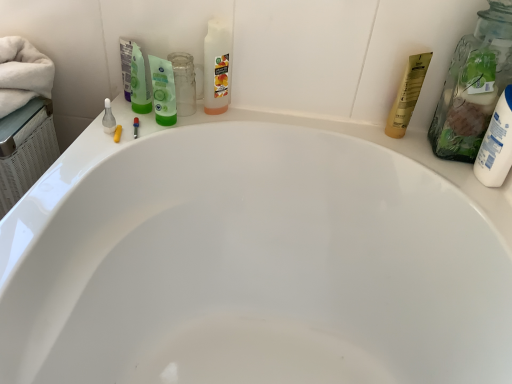
The height and width of the screenshot is (384, 512). What do you see at coordinates (407, 95) in the screenshot?
I see `yellow matte tube at upper right, the 2th toiletry viewed from the front` at bounding box center [407, 95].

Find the location of a particular element. The width and height of the screenshot is (512, 384). yellow matte tube at upper right, the second toiletry from the right is located at coordinates (407, 95).

Is translucent glass jar at upper right completely or partially inside yellow matte tube at upper right, the second toiletry from the right?

No, translucent glass jar at upper right is not a part of yellow matte tube at upper right, the second toiletry from the right.

What's the angular difference between yellow matte tube at upper right, the second toiletry from the right, and translucent glass jar at upper right's facing directions?

91.2 degrees separate the facing orientations of yellow matte tube at upper right, the second toiletry from the right, and translucent glass jar at upper right.

From the image's perspective, which one is positioned higher, yellow matte tube at upper right, the 2th toiletry viewed from the front, or translucent glass jar at upper right?

translucent glass jar at upper right is shown above in the image.

Is translucent glass jar at upper right at the back of yellow matte tube at upper right, the second toiletry from the right?

yellow matte tube at upper right, the second toiletry from the right, is not turned away from translucent glass jar at upper right.

Image resolution: width=512 pixels, height=384 pixels. In order to click on toiletry located behind the green matte mouthwash at upper center in this screenshot , I will do `click(407, 95)`.

Is there a large distance between green matte mouthwash at upper center and yellow matte tube at upper right, the first toiletry when ordered from back to front?

green matte mouthwash at upper center is actually quite close to yellow matte tube at upper right, the first toiletry when ordered from back to front.

Is green matte mouthwash at upper center taller or shorter than yellow matte tube at upper right, the second toiletry from the right?

Clearly, green matte mouthwash at upper center is shorter compared to yellow matte tube at upper right, the second toiletry from the right.

From a real-world perspective, is green matte mouthwash at upper center above or below yellow matte tube at upper right, the 2th toiletry viewed from the front?

green matte mouthwash at upper center is below yellow matte tube at upper right, the 2th toiletry viewed from the front.

Would you say translucent glass jar at upper right is to the left or to the right of yellow matte tube at upper right, the first toiletry when ordered from back to front, in the picture?

translucent glass jar at upper right is to the right of yellow matte tube at upper right, the first toiletry when ordered from back to front.

Does translucent glass jar at upper right have a larger size compared to yellow matte tube at upper right, the 2th toiletry viewed from the front?

Correct, translucent glass jar at upper right is larger in size than yellow matte tube at upper right, the 2th toiletry viewed from the front.

From a real-world perspective, is translucent glass jar at upper right physically located above or below yellow matte tube at upper right, placed as the first toiletry when sorted from left to right?

From a real-world perspective, translucent glass jar at upper right is physically above yellow matte tube at upper right, placed as the first toiletry when sorted from left to right.

Is translucent glass jar at upper right inside white matte lotion at right, the first toiletry viewed from the front?

That's incorrect, translucent glass jar at upper right is not inside white matte lotion at right, the first toiletry viewed from the front.

Which object is more forward, white matte lotion at right, arranged as the second toiletry when viewed from the back, or translucent glass jar at upper right?

white matte lotion at right, arranged as the second toiletry when viewed from the back, is more forward.

Can you confirm if white matte lotion at right, arranged as the second toiletry when viewed from the back, is wider than translucent glass jar at upper right?

Incorrect, the width of white matte lotion at right, arranged as the second toiletry when viewed from the back, does not surpass that of translucent glass jar at upper right.

I want to click on toiletry that appears on the right of yellow matte tube at upper right, the 2th toiletry viewed from the front, so click(x=496, y=144).

Based on the photo, is yellow matte tube at upper right, placed as the first toiletry when sorted from left to right, located outside white matte lotion at right, arranged as the second toiletry when viewed from the back?

Yes, yellow matte tube at upper right, placed as the first toiletry when sorted from left to right, is outside of white matte lotion at right, arranged as the second toiletry when viewed from the back.

Relative to white matte lotion at right, arranged as the second toiletry when viewed from the back, is yellow matte tube at upper right, the second toiletry from the right, in front or behind?

yellow matte tube at upper right, the second toiletry from the right, is behind white matte lotion at right, arranged as the second toiletry when viewed from the back.

Is yellow matte tube at upper right, the second toiletry from the right, far away from white matte lotion at right, arranged as the second toiletry when viewed from the back?

No, yellow matte tube at upper right, the second toiletry from the right, is not far away from white matte lotion at right, arranged as the second toiletry when viewed from the back.

Is yellow matte tube at upper right, placed as the first toiletry when sorted from left to right, not close to green matte mouthwash at upper center?

That's not correct — yellow matte tube at upper right, placed as the first toiletry when sorted from left to right, is a little close to green matte mouthwash at upper center.

Can you confirm if yellow matte tube at upper right, the first toiletry when ordered from back to front, is positioned to the left of green matte mouthwash at upper center?

In fact, yellow matte tube at upper right, the first toiletry when ordered from back to front, is to the right of green matte mouthwash at upper center.

Which point is more distant from viewer, (419, 91) or (175, 116)?

The point (419, 91) is behind.

Is translucent glass jar at upper right bigger or smaller than white matte lotion at right, arranged as the second toiletry when viewed from the back?

Clearly, translucent glass jar at upper right is larger in size than white matte lotion at right, arranged as the second toiletry when viewed from the back.

Is translucent glass jar at upper right positioned before white matte lotion at right, marked as the first toiletry in a right-to-left arrangement?

No, translucent glass jar at upper right is behind white matte lotion at right, marked as the first toiletry in a right-to-left arrangement.

Is translucent glass jar at upper right oriented away from white matte lotion at right, the 2th toiletry in the left-to-right sequence?

No, translucent glass jar at upper right's orientation is not away from white matte lotion at right, the 2th toiletry in the left-to-right sequence.

Would you say translucent glass jar at upper right is outside white matte lotion at right, the first toiletry viewed from the front?

Yes, translucent glass jar at upper right is outside of white matte lotion at right, the first toiletry viewed from the front.

This screenshot has width=512, height=384. In order to click on cleaning product to the right of yellow matte tube at upper right, the 2th toiletry viewed from the front in this screenshot , I will do `click(473, 85)`.

The image size is (512, 384). In order to click on toiletry behind the green matte mouthwash at upper center in this screenshot , I will do `click(407, 95)`.

Based on their spatial positions, is translucent glass jar at upper right or yellow matte tube at upper right, placed as the first toiletry when sorted from left to right, further from white matte lotion at right, arranged as the second toiletry when viewed from the back?

yellow matte tube at upper right, placed as the first toiletry when sorted from left to right.

Which object lies nearer to the anchor point translucent glass jar at upper right, green matte mouthwash at upper center or white matte lotion at right, arranged as the second toiletry when viewed from the back?

white matte lotion at right, arranged as the second toiletry when viewed from the back, is closer to translucent glass jar at upper right.

From the image, which object appears to be nearer to translucent glass jar at upper right, white matte lotion at right, the first toiletry viewed from the front, or yellow matte tube at upper right, the second toiletry from the right?

The object closer to translucent glass jar at upper right is white matte lotion at right, the first toiletry viewed from the front.

From the image, which object appears to be farther from white matte lotion at right, arranged as the second toiletry when viewed from the back, green matte mouthwash at upper center or yellow matte tube at upper right, the second toiletry from the right?

green matte mouthwash at upper center is further to white matte lotion at right, arranged as the second toiletry when viewed from the back.

From the image, which object appears to be nearer to yellow matte tube at upper right, placed as the first toiletry when sorted from left to right, translucent glass jar at upper right or white matte lotion at right, the first toiletry viewed from the front?

translucent glass jar at upper right.

From the image, which object appears to be farther from translucent glass jar at upper right, yellow matte tube at upper right, the first toiletry when ordered from back to front, or white matte lotion at right, the first toiletry viewed from the front?

yellow matte tube at upper right, the first toiletry when ordered from back to front, lies further to translucent glass jar at upper right than the other object.

Estimate the real-world distances between objects in this image. Which object is closer to white matte lotion at right, arranged as the second toiletry when viewed from the back, yellow matte tube at upper right, the second toiletry from the right, or green matte mouthwash at upper center?

The object closer to white matte lotion at right, arranged as the second toiletry when viewed from the back, is yellow matte tube at upper right, the second toiletry from the right.

Considering their positions, is translucent glass jar at upper right positioned further to green matte mouthwash at upper center than yellow matte tube at upper right, the first toiletry when ordered from back to front?

translucent glass jar at upper right.

You are a GUI agent. You are given a task and a screenshot of the screen. Output one action in this format:
    pyautogui.click(x=<x>, y=<y>)
    Task: Click on the toiletry between green matte mouthwash at upper center and translucent glass jar at upper right
    This screenshot has height=384, width=512.
    Given the screenshot: What is the action you would take?
    pyautogui.click(x=407, y=95)

Identify the location of cleaning product between green matte mouthwash at upper center and white matte lotion at right, arranged as the second toiletry when viewed from the back. The image size is (512, 384). (473, 85).

Find the location of a particular element. cleaning product between white matte lotion at right, the first toiletry viewed from the front, and yellow matte tube at upper right, placed as the first toiletry when sorted from left to right, from front to back is located at coordinates (473, 85).

You are a GUI agent. You are given a task and a screenshot of the screen. Output one action in this format:
    pyautogui.click(x=<x>, y=<y>)
    Task: Click on the toiletry between green matte mouthwash at upper center and white matte lotion at right, arranged as the second toiletry when viewed from the back, from left to right
    This screenshot has height=384, width=512.
    Given the screenshot: What is the action you would take?
    pyautogui.click(x=407, y=95)